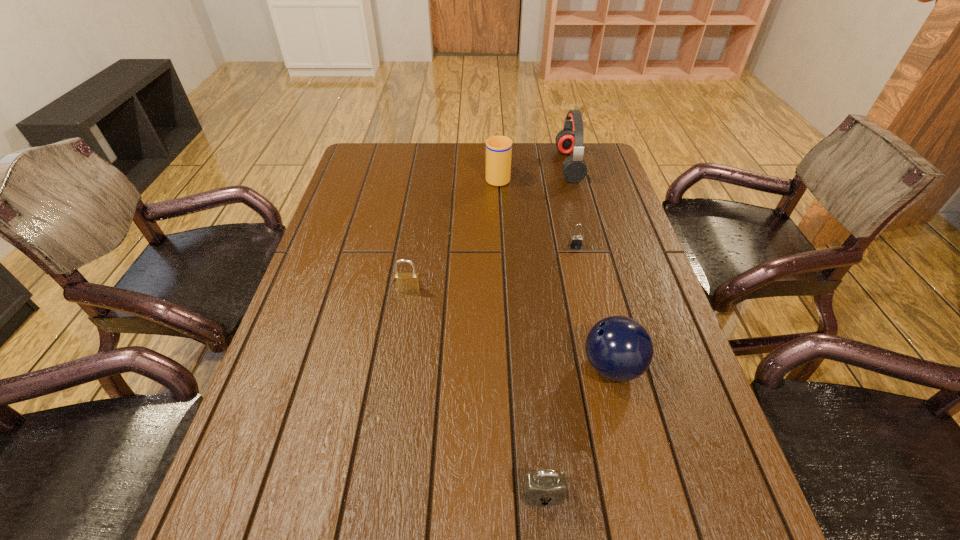
You are a GUI agent. You are given a task and a screenshot of the screen. Output one action in this format:
    pyautogui.click(x=<x>, y=<y>)
    Task: Click on the earphone present at the far edge
    The height and width of the screenshot is (540, 960).
    Given the screenshot: What is the action you would take?
    pyautogui.click(x=569, y=140)

The height and width of the screenshot is (540, 960). I want to click on cup that is at the far edge, so click(x=498, y=148).

What are the coordinates of `earphone that is positioned at the right edge` in the screenshot? It's located at (569, 140).

The height and width of the screenshot is (540, 960). Identify the location of bowling ball that is at the right edge. (619, 348).

Find the location of a particular element. The width and height of the screenshot is (960, 540). object located in the far right corner section of the desktop is located at coordinates (569, 140).

You are a GUI agent. You are given a task and a screenshot of the screen. Output one action in this format:
    pyautogui.click(x=<x>, y=<y>)
    Task: Click on the vacant space at the far edge
    
    Given the screenshot: What is the action you would take?
    pyautogui.click(x=444, y=152)

Identify the location of vacant space at the left edge of the desktop. Image resolution: width=960 pixels, height=540 pixels. (355, 244).

Locate an element on the screen. This screenshot has height=540, width=960. free space at the right edge of the desktop is located at coordinates (632, 237).

Where is `unoccupied position between the cup and the bowling ball`? The width and height of the screenshot is (960, 540). unoccupied position between the cup and the bowling ball is located at coordinates (555, 272).

The image size is (960, 540). In order to click on blank region between the fifth farthest object and the earphone in this screenshot , I will do `click(590, 266)`.